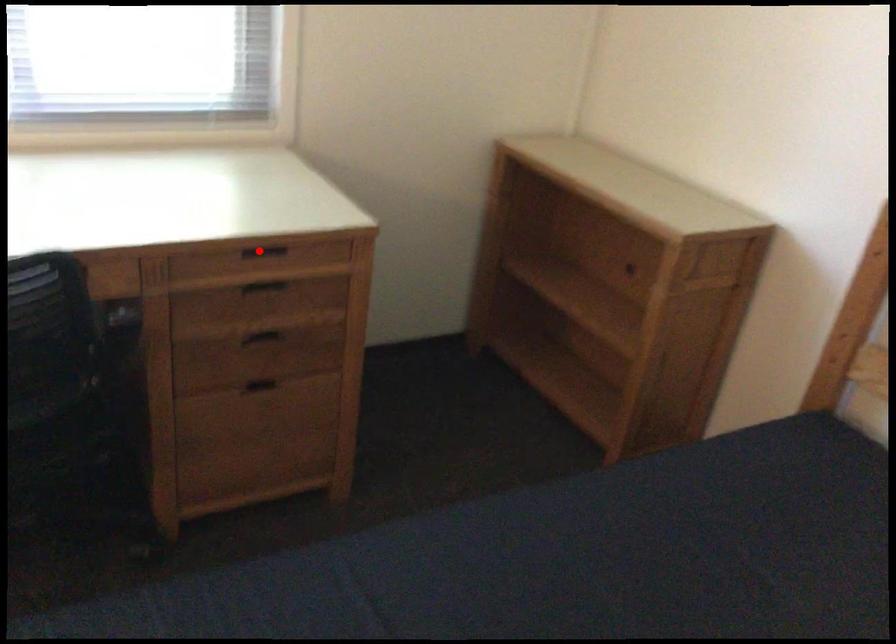
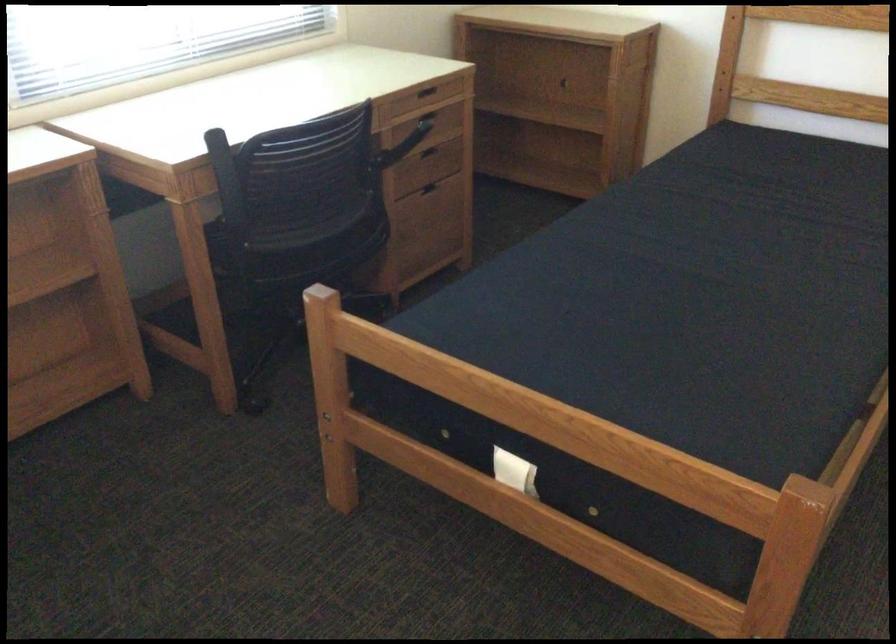
Question: A red point is marked in image1. In image2, is the corresponding 3D point closer to the camera or farther? Reply with the corresponding letter.

Choices:
 (A) The corresponding 3D point is closer.
 (B) The corresponding 3D point is farther.

Answer: (B)